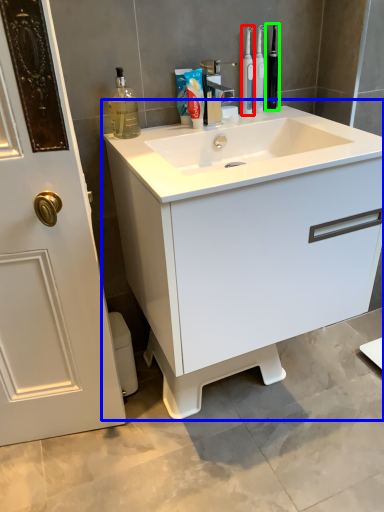
Question: Which object is positioned closest to mouthwash (highlighted by a red box)? Select from bathroom cabinet (highlighted by a blue box) and toiletry (highlighted by a green box).

Choices:
 (A) bathroom cabinet
 (B) toiletry

Answer: (B)